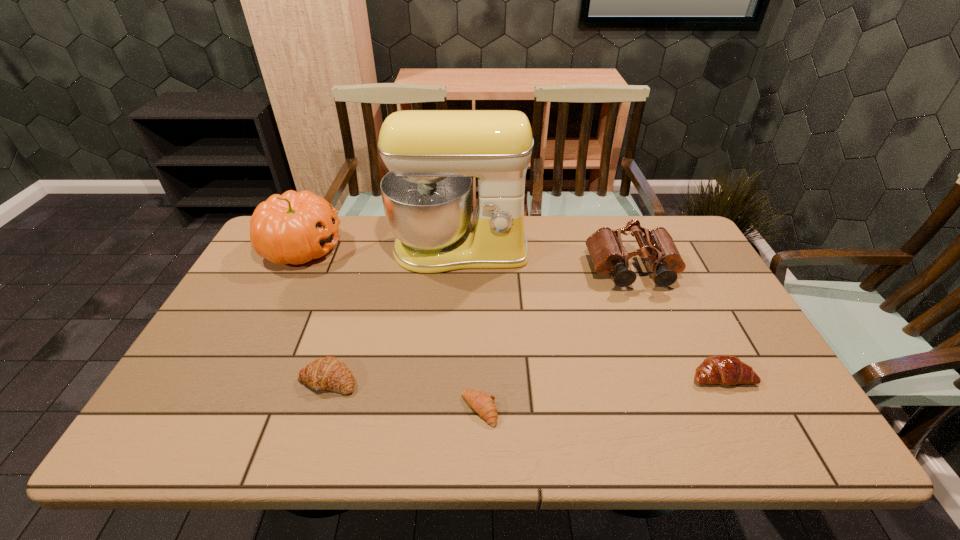
Where is `crescent roll that is the closest to the tallest object`? This screenshot has height=540, width=960. crescent roll that is the closest to the tallest object is located at coordinates (329, 373).

Image resolution: width=960 pixels, height=540 pixels. What are the coordinates of `free point that satisfies the following two spatial constraints: 1. on the carved face of the second object from left to right; 2. on the right side of the pumpkin` in the screenshot? It's located at (236, 380).

Where is `free space in the image that satisfies the following two spatial constraints: 1. on the carved face of the leftmost object; 2. on the right side of the leftmost crescent roll`? The image size is (960, 540). free space in the image that satisfies the following two spatial constraints: 1. on the carved face of the leftmost object; 2. on the right side of the leftmost crescent roll is located at coordinates (236, 380).

The height and width of the screenshot is (540, 960). Identify the location of vacant position in the image that satisfies the following two spatial constraints: 1. through the eyepieces of the rightmost crescent roll; 2. on the left side of the fourth shortest object. (675, 376).

Where is `vacant area in the image that satisfies the following two spatial constraints: 1. on the carved face of the shortest crescent roll; 2. on the left side of the pumpkin`? vacant area in the image that satisfies the following two spatial constraints: 1. on the carved face of the shortest crescent roll; 2. on the left side of the pumpkin is located at coordinates (221, 410).

Find the location of `vacant area in the image that satisfies the following two spatial constraints: 1. on the side of the rightmost crescent roll with the control knob; 2. on the left side of the mixer`. vacant area in the image that satisfies the following two spatial constraints: 1. on the side of the rightmost crescent roll with the control knob; 2. on the left side of the mixer is located at coordinates (452, 376).